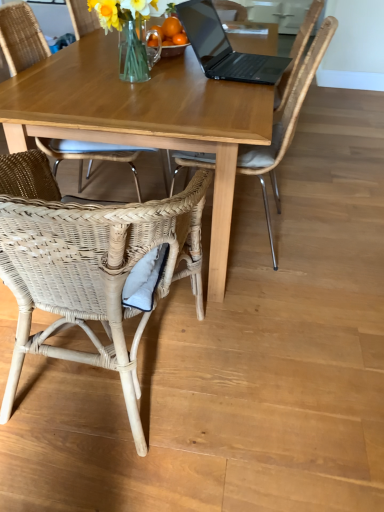
This screenshot has height=512, width=384. I want to click on free area in between black matte laptop at upper center and translucent glass vase at upper center, so click(191, 77).